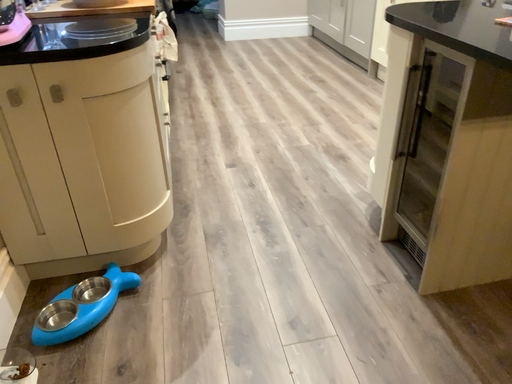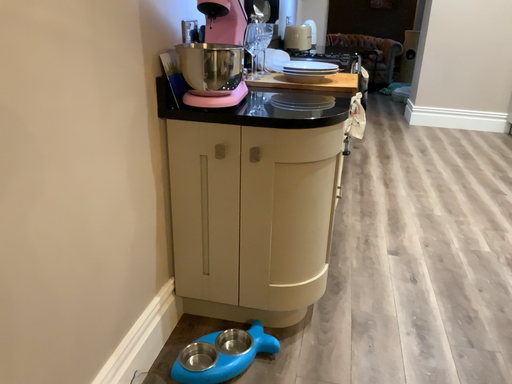
Question: Which way did the camera rotate in the video?

Choices:
 (A) rotated upward
 (B) rotated downward

Answer: (A)